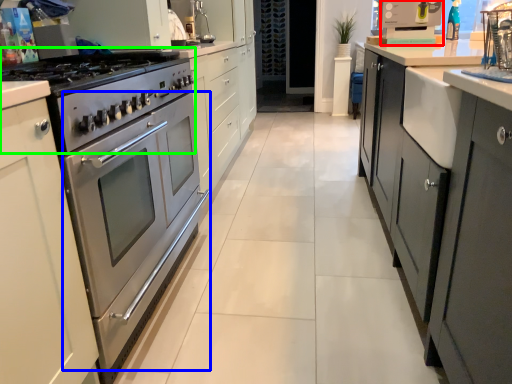
Question: Which object is the closest to the appliance (highlighted by a red box)? Choose among these: oven (highlighted by a blue box) or gas stove (highlighted by a green box).

Choices:
 (A) oven
 (B) gas stove

Answer: (B)